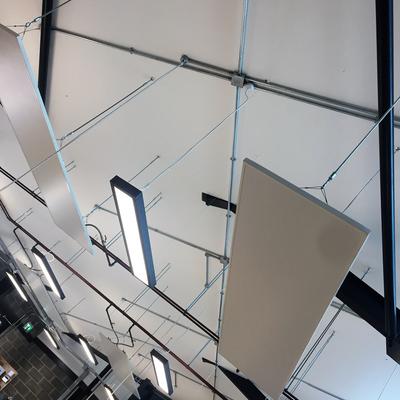
You are a GUI agent. You are given a task and a screenshot of the screen. Output one action in this format:
    pyautogui.click(x=<x>, y=<y>)
    Task: Click on the ceiling
    The image size is (400, 400).
    Given the screenshot: What is the action you would take?
    pyautogui.click(x=303, y=125)